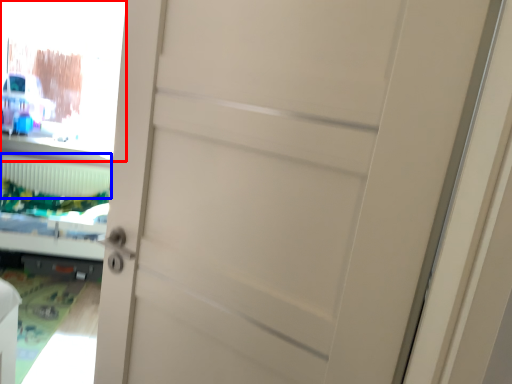
Question: Which point is further to the camera, window screen (highlighted by a red box) or radiator (highlighted by a blue box)?

Choices:
 (A) window screen
 (B) radiator

Answer: (B)